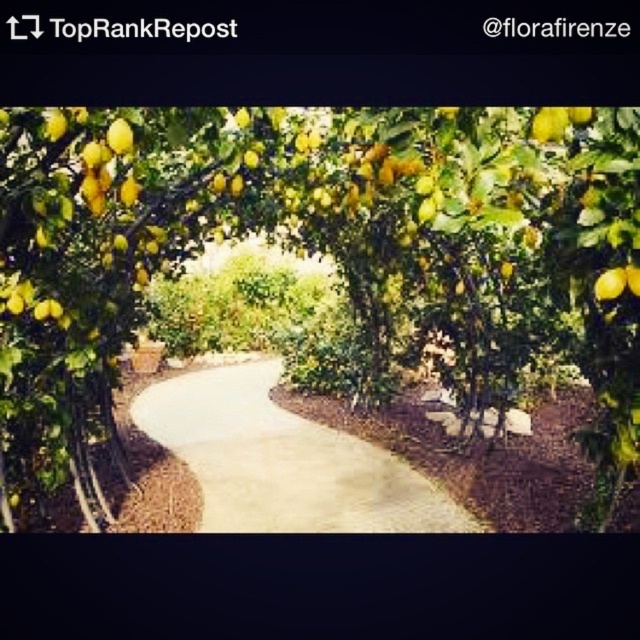
Question: Is the position of yellow matte lemon tree at center less distant than that of yellow matte lemon at upper right?

Choices:
 (A) no
 (B) yes

Answer: (B)

Question: Can you confirm if yellow matte lemon tree at center is positioned below smooth concrete path at center?

Choices:
 (A) no
 (B) yes

Answer: (A)

Question: Which object appears closest to the camera in this image?

Choices:
 (A) yellow matte lemon tree at center
 (B) smooth concrete path at center
 (C) yellow matte lemon at upper right

Answer: (A)

Question: Which of the following is the closest to the observer?

Choices:
 (A) smooth concrete path at center
 (B) yellow matte lemon tree at center

Answer: (B)

Question: Among these points, which one is farthest from the camera?

Choices:
 (A) (202, 452)
 (B) (605, 298)
 (C) (488, 115)

Answer: (A)

Question: Can you confirm if smooth concrete path at center is positioned to the right of yellow matte lemon at upper right?

Choices:
 (A) yes
 (B) no

Answer: (B)